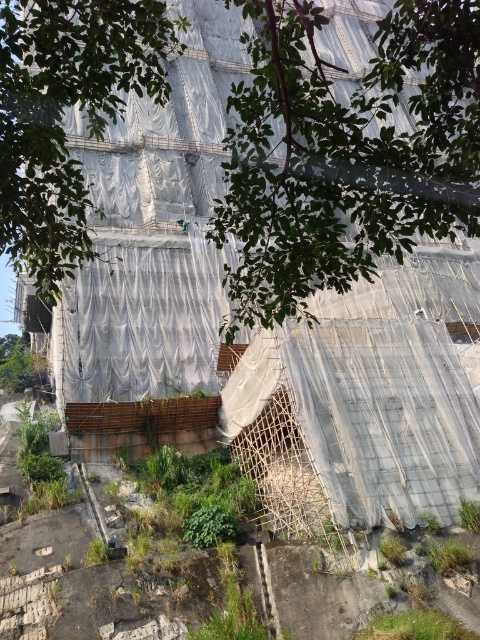
Which is more to the right, green leafy tree at upper center or green leafy tree at center?

Positioned to the right is green leafy tree at upper center.

Is point (225, 209) less distant than point (32, 209)?

No, (225, 209) is behind (32, 209).

Between point (3, 67) and point (20, 253), which one is positioned in front?

Positioned in front is point (3, 67).

Where is `green leafy tree at upper center`? green leafy tree at upper center is located at coordinates click(348, 148).